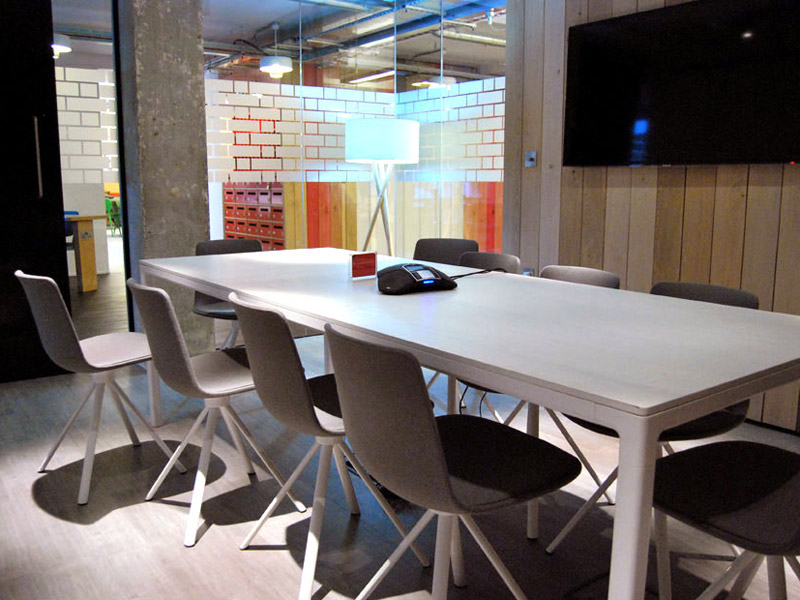
The image size is (800, 600). What are the coordinates of `yellow table` in the screenshot? It's located at (81, 260).